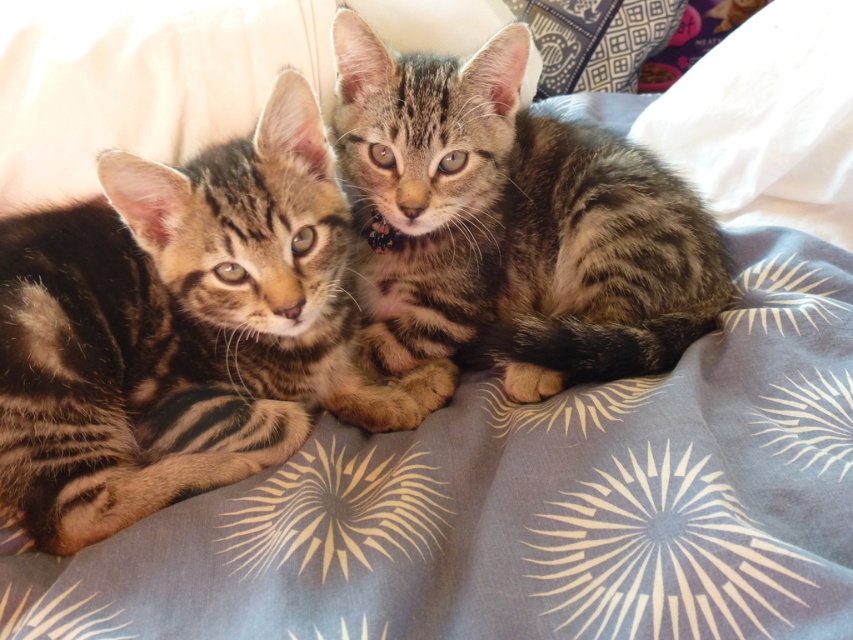
Is striped fur kitten at center positioned in front of tabby fur kitten at center?

Yes, striped fur kitten at center is closer to the viewer.

Is striped fur kitten at center to the right of tabby fur kitten at center from the viewer's perspective?

No, striped fur kitten at center is not to the right of tabby fur kitten at center.

I want to click on striped fur kitten at center, so (x=178, y=328).